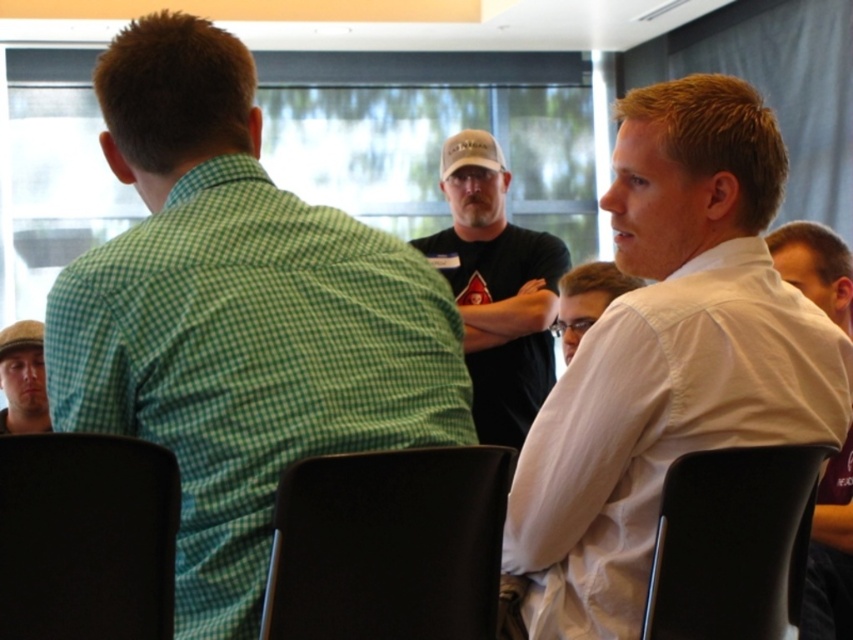
Question: Which of these objects is positioned closest to the matte gray cap at lower left?

Choices:
 (A) black plastic chair at lower left
 (B) black plastic chair at center
 (C) white smooth shirt at right
 (D) black plastic chair at lower right

Answer: (A)

Question: Is black plastic chair at center behind white shirt at center?

Choices:
 (A) yes
 (B) no

Answer: (B)

Question: Which point is farther to the camera?

Choices:
 (A) (41, 355)
 (B) (276, 589)
 (C) (509, 317)
 (D) (804, 636)

Answer: (C)

Question: Which of the following is the farthest from the observer?

Choices:
 (A) matte gray cap at lower left
 (B) black plastic chair at lower left

Answer: (A)

Question: In this image, where is black plastic chair at center located relative to dark gray cap at center?

Choices:
 (A) above
 (B) below

Answer: (B)

Question: Does white smooth shirt at right have a lesser width compared to dark gray cap at center?

Choices:
 (A) yes
 (B) no

Answer: (B)